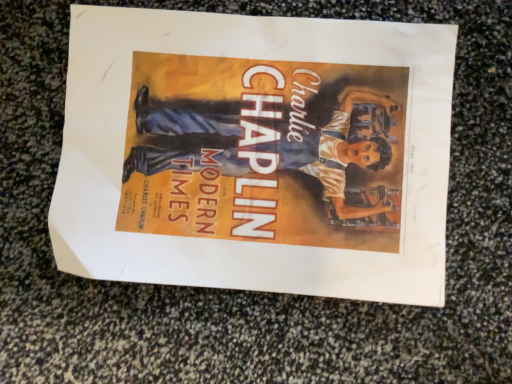
Identify the location of free point above matte paper poster at center (from a real-world perspective). (257, 149).